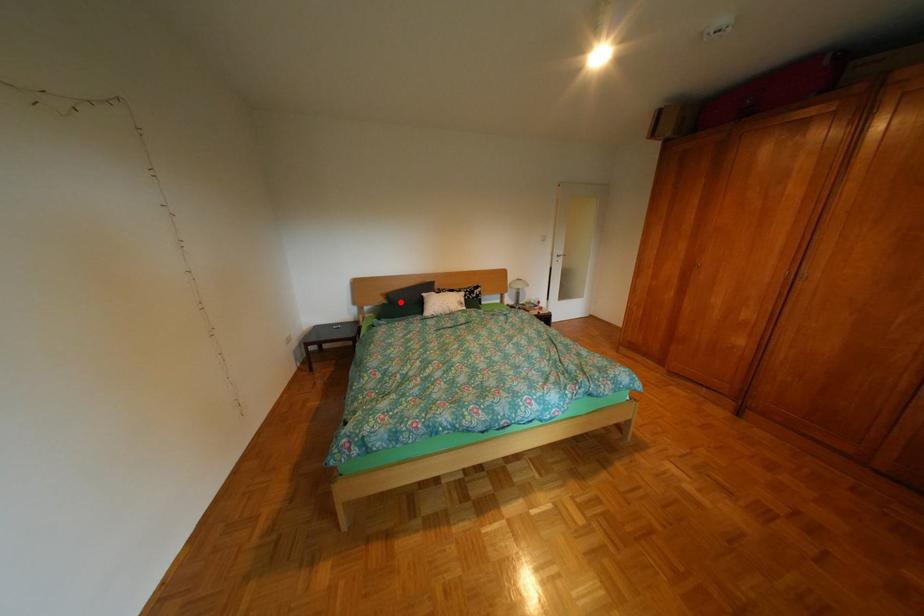
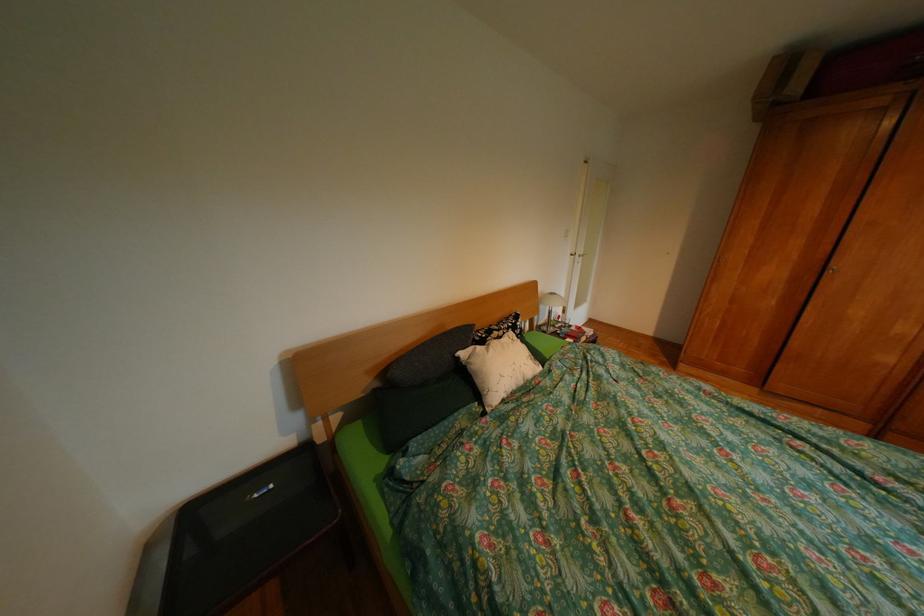
Question: I am providing you with two images of the same scene from different viewpoints. A red point is shown in image1. For the corresponding object point in image2, is it positioned nearer or farther from the camera?

Choices:
 (A) Nearer
 (B) Farther

Answer: (B)